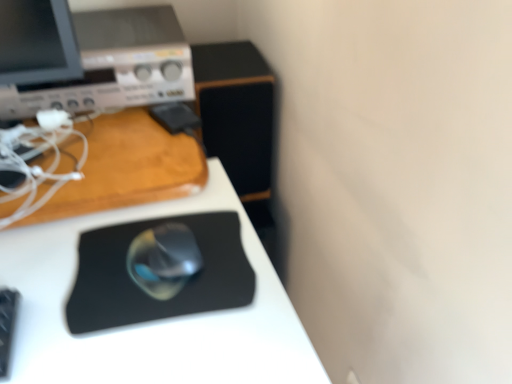
Where is `satin silver mouse at center`? Image resolution: width=512 pixels, height=384 pixels. satin silver mouse at center is located at coordinates (163, 259).

The height and width of the screenshot is (384, 512). What are the coordinates of `black rubber mousepad at center` in the screenshot? It's located at (159, 271).

Measure the distance between black matte mouse pad at center and camera.

The depth of black matte mouse pad at center is 21.87 inches.

What are the coordinates of `black matte mouse pad at center` in the screenshot? It's located at (153, 323).

This screenshot has width=512, height=384. What do you see at coordinates (115, 65) in the screenshot? I see `matte silver desktop computer at upper left` at bounding box center [115, 65].

What is the approximate height of matte silver desktop computer at upper left?

matte silver desktop computer at upper left is 6.56 inches in height.

Where is `satin silver mouse at center`? This screenshot has width=512, height=384. satin silver mouse at center is located at coordinates (163, 259).

Between satin silver mouse at center and black rubber mousepad at center, which one appears on the right side from the viewer's perspective?

black rubber mousepad at center.

Does satin silver mouse at center turn towards black rubber mousepad at center?

Yes, satin silver mouse at center is oriented towards black rubber mousepad at center.

Is satin silver mouse at center in front of or behind black rubber mousepad at center in the image?

Clearly, satin silver mouse at center is behind black rubber mousepad at center.

Which of these two, satin silver mouse at center or black rubber mousepad at center, stands taller?

satin silver mouse at center is taller.

Is satin silver mouse at center beside matte silver desktop computer at upper left?

They are not placed beside each other.

Can you confirm if satin silver mouse at center is taller than matte silver desktop computer at upper left?

No, satin silver mouse at center is not taller than matte silver desktop computer at upper left.

Is satin silver mouse at center spatially inside matte silver desktop computer at upper left, or outside of it?

satin silver mouse at center is not inside matte silver desktop computer at upper left, it's outside.

Is point (128, 260) positioned after point (82, 105)?

No, (128, 260) is in front of (82, 105).

Considering the sizes of objects black rubber mousepad at center and matte silver desktop computer at upper left in the image provided, who is shorter, black rubber mousepad at center or matte silver desktop computer at upper left?

Standing shorter between the two is black rubber mousepad at center.

Is black rubber mousepad at center surrounding matte silver desktop computer at upper left?

No, matte silver desktop computer at upper left is not a part of black rubber mousepad at center.

Between black rubber mousepad at center and matte silver desktop computer at upper left, which one appears on the right side from the viewer's perspective?

Positioned to the right is black rubber mousepad at center.

Considering the positions of points (153, 294) and (180, 53), is point (153, 294) closer to camera compared to point (180, 53)?

Yes, it is.

At what (x,y) coordinates should I click in order to perform the action: click on mousepad above the black matte mouse pad at center (from a real-world perspective). Please return your answer as a coordinate pair (x, y). This screenshot has height=384, width=512. Looking at the image, I should click on (159, 271).

Which is closer to the camera, [188,241] or [221,342]?

Point [188,241] is farther from the camera than point [221,342].

From the image's perspective, would you say black rubber mousepad at center is shown under black matte mouse pad at center?

No, from the image's perspective, black rubber mousepad at center is not below black matte mouse pad at center.

Is the depth of black rubber mousepad at center greater than that of black matte mouse pad at center?

Yes, black rubber mousepad at center is further from the camera.

Which is behind, black matte mouse pad at center or black rubber mousepad at center?

black rubber mousepad at center.

Could you tell me if black matte mouse pad at center is turned towards black rubber mousepad at center?

No, black matte mouse pad at center is not facing towards black rubber mousepad at center.

Considering the sizes of objects black matte mouse pad at center and black rubber mousepad at center in the image provided, who is taller, black matte mouse pad at center or black rubber mousepad at center?

Standing taller between the two is black matte mouse pad at center.

Between point (69, 279) and point (231, 212), which one is positioned behind?

The point (231, 212) is farther from the camera.

Which of these two, matte silver desktop computer at upper left or satin silver mouse at center, stands shorter?

Standing shorter between the two is satin silver mouse at center.

From a real-world perspective, does matte silver desktop computer at upper left sit lower than satin silver mouse at center?

No, from a real-world perspective, matte silver desktop computer at upper left is not below satin silver mouse at center.

Considering the sizes of matte silver desktop computer at upper left and satin silver mouse at center in the image, is matte silver desktop computer at upper left wider or thinner than satin silver mouse at center?

Considering their sizes, matte silver desktop computer at upper left looks broader than satin silver mouse at center.

Does point (123, 35) come in front of point (160, 276)?

No, (123, 35) is further to viewer.

Between black matte mouse pad at center and matte silver desktop computer at upper left, which one has more height?

black matte mouse pad at center.

Are black matte mouse pad at center and matte silver desktop computer at upper left making contact?

They are not placed beside each other.

Consider the image. From a real-world perspective, which object stands above the other?

matte silver desktop computer at upper left is physically above.

This screenshot has height=384, width=512. In order to click on desktop computer that is above the black matte mouse pad at center (from a real-world perspective) in this screenshot , I will do `click(115, 65)`.

In the image, there is a satin silver mouse at center. Where is `mousepad below it (from the image's perspective)`? This screenshot has height=384, width=512. mousepad below it (from the image's perspective) is located at coordinates (159, 271).

Identify the location of desktop computer located on the left of satin silver mouse at center. The height and width of the screenshot is (384, 512). (115, 65).

Which object lies nearer to the anchor point black matte mouse pad at center, satin silver mouse at center or black rubber mousepad at center?

black rubber mousepad at center lies closer to black matte mouse pad at center than the other object.

From the image, which object appears to be farther from black rubber mousepad at center, satin silver mouse at center or matte silver desktop computer at upper left?

matte silver desktop computer at upper left.

In the scene shown: Which object lies further to the anchor point black matte mouse pad at center, matte silver desktop computer at upper left or satin silver mouse at center?

matte silver desktop computer at upper left is positioned further to the anchor black matte mouse pad at center.

Which object lies nearer to the anchor point satin silver mouse at center, black matte mouse pad at center or matte silver desktop computer at upper left?

black matte mouse pad at center.

Looking at the image, which one is located closer to matte silver desktop computer at upper left, black matte mouse pad at center or black rubber mousepad at center?

black matte mouse pad at center is positioned closer to the anchor matte silver desktop computer at upper left.

From the image, which object appears to be farther from satin silver mouse at center, matte silver desktop computer at upper left or black rubber mousepad at center?

matte silver desktop computer at upper left is further to satin silver mouse at center.

From the image, which object appears to be farther from black rubber mousepad at center, matte silver desktop computer at upper left or black matte mouse pad at center?

matte silver desktop computer at upper left.

Which object lies further to the anchor point matte silver desktop computer at upper left, satin silver mouse at center or black matte mouse pad at center?

Based on the image, satin silver mouse at center appears to be further to matte silver desktop computer at upper left.

This screenshot has width=512, height=384. I want to click on mouse between matte silver desktop computer at upper left and black rubber mousepad at center in the up-down direction, so click(x=163, y=259).

Where is `mouse between matte silver desktop computer at upper left and black matte mouse pad at center in the up-down direction`? The width and height of the screenshot is (512, 384). mouse between matte silver desktop computer at upper left and black matte mouse pad at center in the up-down direction is located at coordinates (163, 259).

At what (x,y) coordinates should I click in order to perform the action: click on mousepad between matte silver desktop computer at upper left and black matte mouse pad at center from top to bottom. Please return your answer as a coordinate pair (x, y). Image resolution: width=512 pixels, height=384 pixels. Looking at the image, I should click on (159, 271).

I want to click on mousepad between satin silver mouse at center and black matte mouse pad at center in the vertical direction, so click(159, 271).